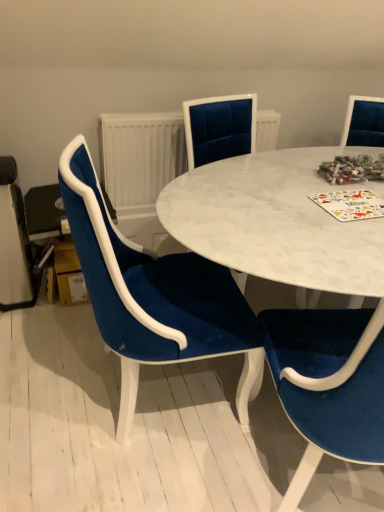
Where is `vacant space underneath velvet blue chair at left, which appears as the second chair when viewed from the right (from a real-world perspective)`? The image size is (384, 512). vacant space underneath velvet blue chair at left, which appears as the second chair when viewed from the right (from a real-world perspective) is located at coordinates (118, 398).